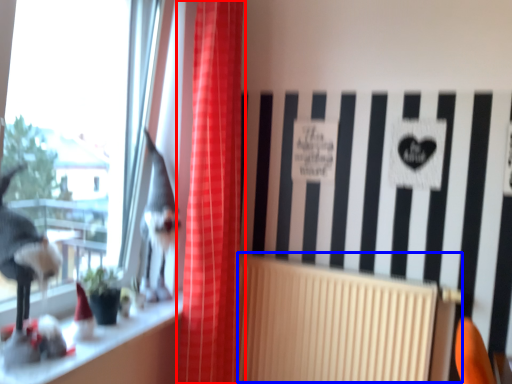
Question: Which point is closer to the camera, curtain (highlighted by a red box) or radiator (highlighted by a blue box)?

Choices:
 (A) curtain
 (B) radiator

Answer: (A)